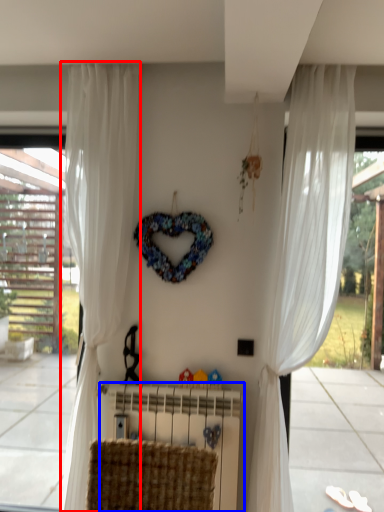
Question: Which of the following is the farthest to the observer, curtain (highlighted by a red box) or radiator (highlighted by a blue box)?

Choices:
 (A) curtain
 (B) radiator

Answer: (B)